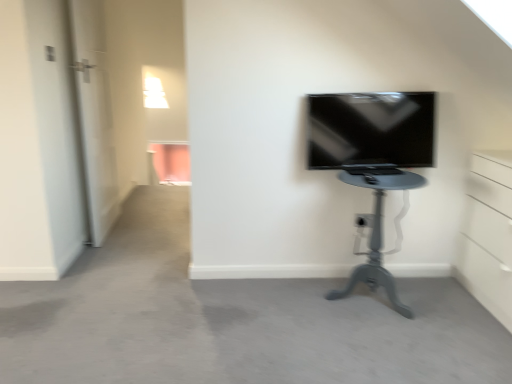
Question: Is the surface of matte gray table at center in direct contact with black glossy tv at upper right?

Choices:
 (A) no
 (B) yes

Answer: (A)

Question: Is matte gray table at center facing towards black glossy tv at upper right?

Choices:
 (A) no
 (B) yes

Answer: (A)

Question: Does matte gray table at center have a lesser height compared to black glossy tv at upper right?

Choices:
 (A) yes
 (B) no

Answer: (B)

Question: From a real-world perspective, is matte gray table at center over black glossy tv at upper right?

Choices:
 (A) no
 (B) yes

Answer: (A)

Question: Does matte gray table at center have a greater height compared to black glossy tv at upper right?

Choices:
 (A) no
 (B) yes

Answer: (B)

Question: Considering the relative positions of matte gray table at center and black glossy tv at upper right in the image provided, is matte gray table at center to the left of black glossy tv at upper right from the viewer's perspective?

Choices:
 (A) yes
 (B) no

Answer: (B)

Question: Is black glossy tv at upper right wider than matte gray table at center?

Choices:
 (A) yes
 (B) no

Answer: (B)

Question: From the image's perspective, does black glossy tv at upper right appear lower than matte gray table at center?

Choices:
 (A) yes
 (B) no

Answer: (B)

Question: Considering the relative sizes of black glossy tv at upper right and matte gray table at center in the image provided, is black glossy tv at upper right taller than matte gray table at center?

Choices:
 (A) yes
 (B) no

Answer: (B)

Question: Is black glossy tv at upper right closer to camera compared to matte gray table at center?

Choices:
 (A) yes
 (B) no

Answer: (B)

Question: Is matte gray table at center located within black glossy tv at upper right?

Choices:
 (A) yes
 (B) no

Answer: (B)

Question: Does black glossy tv at upper right appear on the left side of matte gray table at center?

Choices:
 (A) no
 (B) yes

Answer: (B)

Question: Relative to matte gray table at center, is black glossy tv at upper right in front or behind?

Choices:
 (A) behind
 (B) front

Answer: (A)